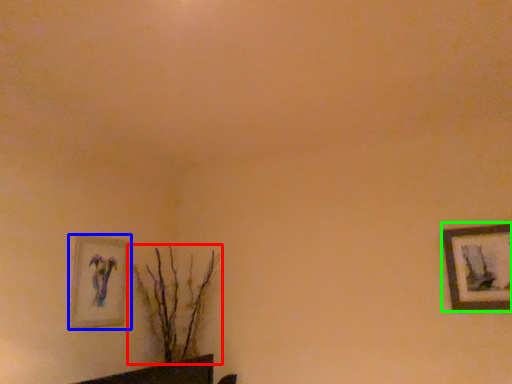
Question: Considering the real-world distances, which object is closest to houseplant (highlighted by a red box)? picture frame (highlighted by a blue box) or picture frame (highlighted by a green box).

Choices:
 (A) picture frame
 (B) picture frame

Answer: (A)